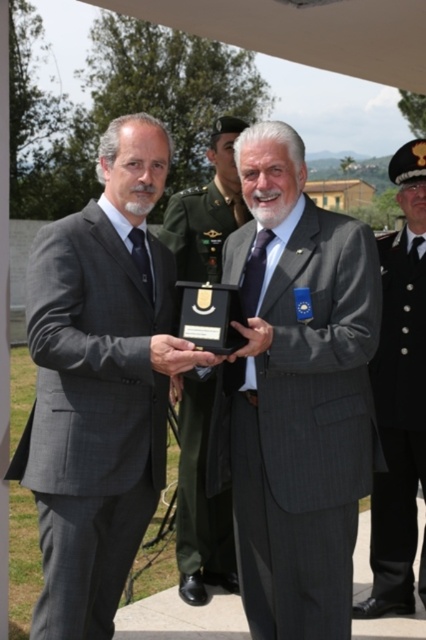
You are a photographer at this event and need to capture a photo where both the matte gray suit at center and the matte black plaque at center are clearly visible. Given their sizes, which object should you focus on first to ensure proper framing?

The matte gray suit at center is taller than the matte black plaque at center, so you should focus on the matte gray suit at center first to ensure proper framing.

You are a photographer at the event and need to capture a photo where the matte gray suit at center and the matte black plaque at center are visible. Based on their positions, which object should be placed closer to the left side of the photo frame?

The matte black plaque at center should be placed closer to the left side of the photo frame because the matte gray suit at center is to the right of it.

What is located at the coordinates point (296, 394) in the image?

The coordinates point (296, 394) in the image correspond to the matte gray suit at center.